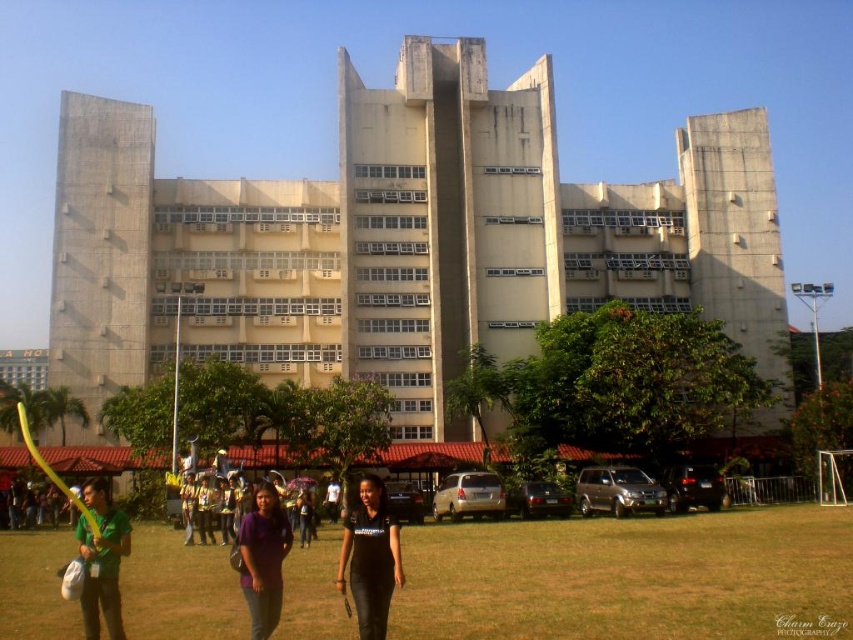
Does black leather pants at center have a greater height compared to purple fabric umbrella at center?

Indeed, black leather pants at center has a greater height compared to purple fabric umbrella at center.

Can you confirm if black leather pants at center is shorter than purple fabric umbrella at center?

Incorrect, black leather pants at center's height does not fall short of purple fabric umbrella at center's.

You are a GUI agent. You are given a task and a screenshot of the screen. Output one action in this format:
    pyautogui.click(x=<x>, y=<y>)
    Task: Click on the black leather pants at center
    The width and height of the screenshot is (853, 640).
    Given the screenshot: What is the action you would take?
    pyautogui.click(x=370, y=557)

Find the location of a particular element. This screenshot has width=853, height=640. black leather pants at center is located at coordinates [x=370, y=557].

Who is positioned more to the left, purple matte shirt at center or purple fabric umbrella at center?

From the viewer's perspective, purple fabric umbrella at center appears more on the left side.

Based on the photo, can you confirm if purple matte shirt at center is wider than purple fabric umbrella at center?

Indeed, purple matte shirt at center has a greater width compared to purple fabric umbrella at center.

Is point (274, 609) positioned behind point (312, 518)?

No, (274, 609) is closer to viewer.

In order to click on purple matte shirt at center in this screenshot , I will do `click(263, 560)`.

Looking at this image, who is positioned more to the right, green matte shirt at lower left or purple fabric umbrella at center?

Positioned to the right is purple fabric umbrella at center.

Is green matte shirt at lower left positioned behind purple fabric umbrella at center?

No.

Is point (97, 548) farther from camera compared to point (306, 512)?

No, (97, 548) is closer to viewer.

Where is `green matte shirt at lower left`? green matte shirt at lower left is located at coordinates (102, 561).